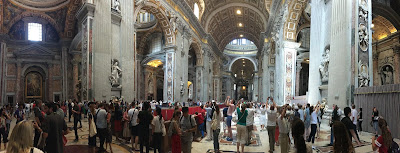
Identify the location of floor. tap(228, 145).